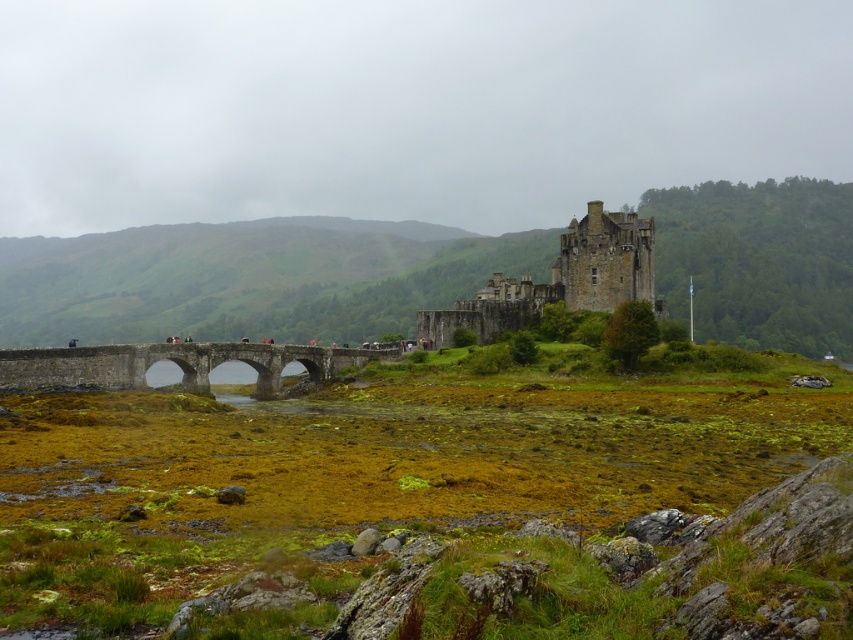
Who is shorter, stone medieval castle at center or stone bridge at center?

With less height is stone bridge at center.

Does point (496, 333) come closer to viewer compared to point (209, 362)?

No.

Identify the location of stone medieval castle at center. The height and width of the screenshot is (640, 853). (560, 280).